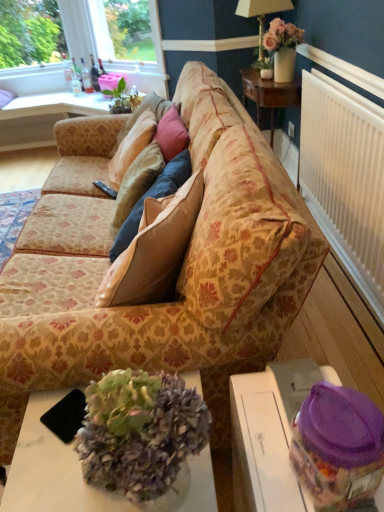
Locate an element on the screen. This screenshot has width=384, height=512. floral-patterned fabric couch at center is located at coordinates (180, 271).

The height and width of the screenshot is (512, 384). What do you see at coordinates (180, 271) in the screenshot? I see `floral-patterned fabric couch at center` at bounding box center [180, 271].

The height and width of the screenshot is (512, 384). In order to click on white marble desk at center in this screenshot , I will do `click(51, 470)`.

Where is `translucent plastic container at lower right, acting as the first table starting from the right`? The width and height of the screenshot is (384, 512). translucent plastic container at lower right, acting as the first table starting from the right is located at coordinates (270, 434).

Looking at this image, considering the positions of objects matte gold lamp at upper center and white marble desk at center in the image provided, who is behind, matte gold lamp at upper center or white marble desk at center?

matte gold lamp at upper center.

Considering the sizes of objects matte gold lamp at upper center and white marble desk at center in the image provided, who is taller, matte gold lamp at upper center or white marble desk at center?

With more height is white marble desk at center.

Is matte gold lamp at upper center thinner than white marble desk at center?

Yes, matte gold lamp at upper center is thinner than white marble desk at center.

In order to click on lamp lying behind the white marble desk at center in this screenshot , I will do `click(261, 15)`.

Considering the sizes of objects translucent plastic container at lower right, which ranks as the 2th table in top-to-bottom order, and matte wood table at upper left, arranged as the second table when viewed from the right, in the image provided, who is wider, translucent plastic container at lower right, which ranks as the 2th table in top-to-bottom order, or matte wood table at upper left, arranged as the second table when viewed from the right,?

matte wood table at upper left, arranged as the second table when viewed from the right.

Considering the relative sizes of translucent plastic container at lower right, the 1th table positioned from the bottom, and matte wood table at upper left, which is the first table from left to right, in the image provided, is translucent plastic container at lower right, the 1th table positioned from the bottom, bigger than matte wood table at upper left, which is the first table from left to right,?

Actually, translucent plastic container at lower right, the 1th table positioned from the bottom, might be smaller than matte wood table at upper left, which is the first table from left to right.

Is point (260, 434) more distant than point (8, 130)?

No, (260, 434) is in front of (8, 130).

From the image's perspective, which object appears higher, translucent plastic container at lower right, placed as the 2th table when sorted from back to front, or matte wood table at upper left, which ranks as the first table in back-to-front order?

From the image's view, matte wood table at upper left, which ranks as the first table in back-to-front order, is above.

In the scene shown: Considering the positions of objects matte gold lamp at upper center and matte wood table at upper left, which ranks as the first table in back-to-front order, in the image provided, who is more to the right, matte gold lamp at upper center or matte wood table at upper left, which ranks as the first table in back-to-front order,?

Positioned to the right is matte gold lamp at upper center.

Consider the image. Is matte gold lamp at upper center completely or partially outside of matte wood table at upper left, which is counted as the second table, starting from the front?

matte gold lamp at upper center lies outside matte wood table at upper left, which is counted as the second table, starting from the front,'s area.

Is matte gold lamp at upper center not near translucent plastic container at lower right, placed as the 2th table when sorted from back to front?

matte gold lamp at upper center is positioned a significant distance from translucent plastic container at lower right, placed as the 2th table when sorted from back to front.

What's the angular difference between matte gold lamp at upper center and translucent plastic container at lower right, placed as the 2th table when sorted from back to front,'s facing directions?

1.02 degrees.

Between matte gold lamp at upper center and translucent plastic container at lower right, the 1th table positioned from the bottom, which one has more height?

translucent plastic container at lower right, the 1th table positioned from the bottom.

From the picture: From the image's perspective, which one is positioned higher, white plastic radiator at right or matte wood table at upper left, which is the first table from left to right?

matte wood table at upper left, which is the first table from left to right, from the image's perspective.

Consider the image. Is white plastic radiator at right beside matte wood table at upper left, arranged as the second table when viewed from the right?

No.

Considering the relative sizes of white plastic radiator at right and matte wood table at upper left, marked as the 2th table in a bottom-to-top arrangement, in the image provided, is white plastic radiator at right wider than matte wood table at upper left, marked as the 2th table in a bottom-to-top arrangement,?

No, white plastic radiator at right is not wider than matte wood table at upper left, marked as the 2th table in a bottom-to-top arrangement.

Considering the sizes of white plastic radiator at right and matte wood table at upper left, which is counted as the second table, starting from the front, in the image, is white plastic radiator at right taller or shorter than matte wood table at upper left, which is counted as the second table, starting from the front,?

Clearly, white plastic radiator at right is taller compared to matte wood table at upper left, which is counted as the second table, starting from the front.

Which point is more distant from viewer, (x=262, y=28) or (x=287, y=41)?

The point (x=262, y=28) is more distant.

What are the coordinates of `lamp located above the pink matte vase at upper right (from the image's perspective)` in the screenshot? It's located at (261, 15).

From the image's perspective, who appears lower, matte gold lamp at upper center or pink matte vase at upper right?

pink matte vase at upper right.

Based on the photo, in terms of width, does white marble desk at center look wider or thinner when compared to white plastic radiator at right?

white marble desk at center is wider than white plastic radiator at right.

Could you tell me if white marble desk at center is facing white plastic radiator at right?

No, white marble desk at center is not oriented towards white plastic radiator at right.

Who is bigger, white marble desk at center or white plastic radiator at right?

white plastic radiator at right is bigger.

Considering the positions of point (112, 510) and point (318, 179), is point (112, 510) closer or farther from the camera than point (318, 179)?

Point (112, 510) is positioned closer to the camera compared to point (318, 179).

The image size is (384, 512). Identify the location of lamp that appears on the right of white marble desk at center. (261, 15).

Where is `table in front of the matte wood table at upper left, marked as the 2th table in a bottom-to-top arrangement`? Image resolution: width=384 pixels, height=512 pixels. table in front of the matte wood table at upper left, marked as the 2th table in a bottom-to-top arrangement is located at coordinates (270, 434).

In the scene shown: Considering their positions, is translucent plastic container at lower right, the 1th table positioned from the bottom, positioned further to matte wood table at upper left, which is the first table from left to right, than white plastic radiator at right?

The object further to matte wood table at upper left, which is the first table from left to right, is translucent plastic container at lower right, the 1th table positioned from the bottom.

Looking at the image, which one is located further to white plastic radiator at right, white marble desk at center or translucent plastic container at lower right, the second table viewed from the left?

Based on the image, white marble desk at center appears to be further to white plastic radiator at right.

Considering their positions, is matte gold lamp at upper center positioned further to pink matte vase at upper right than translucent plastic container at lower right, which ranks as the 2th table in top-to-bottom order?

Based on the image, translucent plastic container at lower right, which ranks as the 2th table in top-to-bottom order, appears to be further to pink matte vase at upper right.

Which object lies nearer to the anchor point matte wood table at upper left, marked as the 2th table in a bottom-to-top arrangement, floral-patterned fabric couch at center or translucent plastic container at lower right, the second table viewed from the left?

Among the two, floral-patterned fabric couch at center is located nearer to matte wood table at upper left, marked as the 2th table in a bottom-to-top arrangement.

From the picture: When comparing their distances from pink matte vase at upper right, does matte wood table at upper left, marked as the 2th table in a bottom-to-top arrangement, or translucent plastic container at lower right, acting as the first table starting from the right, seem further?

translucent plastic container at lower right, acting as the first table starting from the right, is further to pink matte vase at upper right.

Estimate the real-world distances between objects in this image. Which object is closer to floral-patterned fabric couch at center, white marble desk at center or matte gold lamp at upper center?

white marble desk at center is positioned closer to the anchor floral-patterned fabric couch at center.

Based on their spatial positions, is translucent plastic container at lower right, which ranks as the 2th table in top-to-bottom order, or matte gold lamp at upper center closer to white marble desk at center?

translucent plastic container at lower right, which ranks as the 2th table in top-to-bottom order, is closer to white marble desk at center.

From the picture: Considering their positions, is white marble desk at center positioned further to matte wood table at upper left, which ranks as the first table in back-to-front order, than floral-patterned fabric couch at center?

white marble desk at center.

At what (x,y) coordinates should I click in order to perform the action: click on lamp positioned between floral-patterned fabric couch at center and matte wood table at upper left, marked as the 2th table in a bottom-to-top arrangement, from near to far. Please return your answer as a coordinate pair (x, y). This screenshot has height=512, width=384. Looking at the image, I should click on (261, 15).

Image resolution: width=384 pixels, height=512 pixels. Find the location of `table between floral-patterned fabric couch at center and white marble desk at center in the vertical direction`. table between floral-patterned fabric couch at center and white marble desk at center in the vertical direction is located at coordinates (270, 434).

This screenshot has width=384, height=512. I want to click on houseplant between translucent plastic container at lower right, the second table viewed from the left, and matte wood table at upper left, which ranks as the first table in back-to-front order, from front to back, so click(283, 48).

The width and height of the screenshot is (384, 512). I want to click on radiator that lies between matte gold lamp at upper center and white marble desk at center from top to bottom, so click(345, 181).